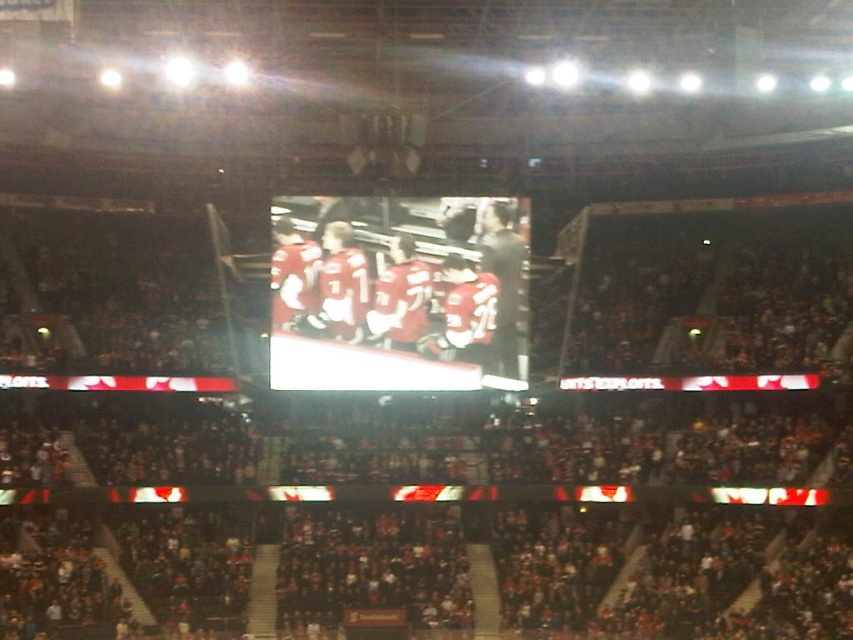
Can you confirm if dark gray stadium seats at center is smaller than matte red jersey at center?

Actually, dark gray stadium seats at center might be larger than matte red jersey at center.

Is dark gray stadium seats at center to the left of matte red jersey at center from the viewer's perspective?

Incorrect, dark gray stadium seats at center is not on the left side of matte red jersey at center.

Is point (258, 396) positioned in front of point (374, 301)?

No, it is behind (374, 301).

You are a GUI agent. You are given a task and a screenshot of the screen. Output one action in this format:
    pyautogui.click(x=<x>, y=<y>)
    Task: Click on the dark gray stadium seats at center
    
    Given the screenshot: What is the action you would take?
    pyautogui.click(x=457, y=499)